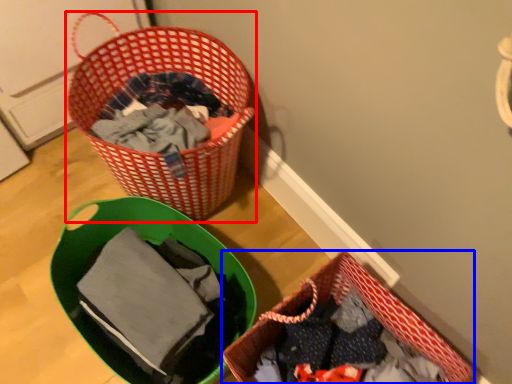
Question: Which object is further to the camera taking this photo, picnic basket (highlighted by a red box) or picnic basket (highlighted by a blue box)?

Choices:
 (A) picnic basket
 (B) picnic basket

Answer: (A)